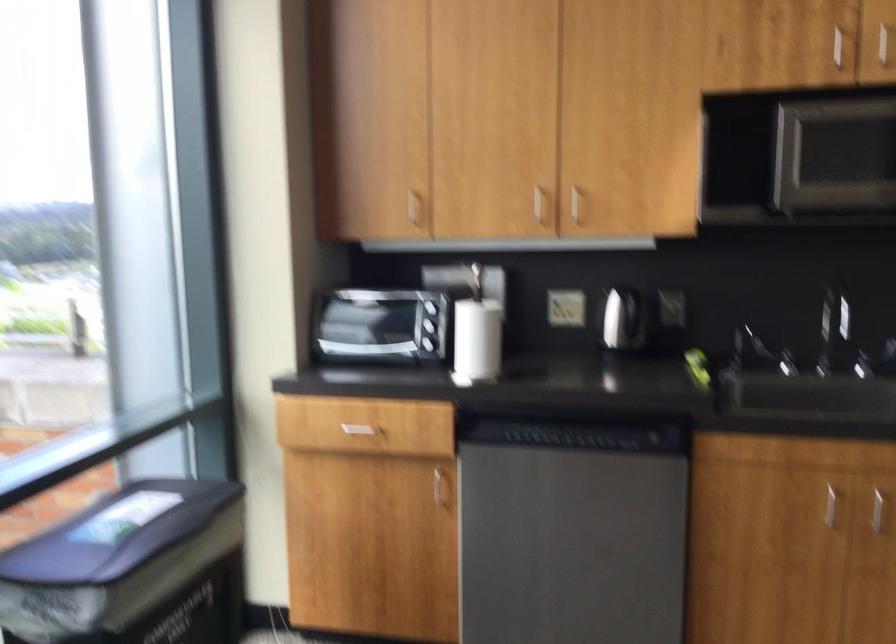
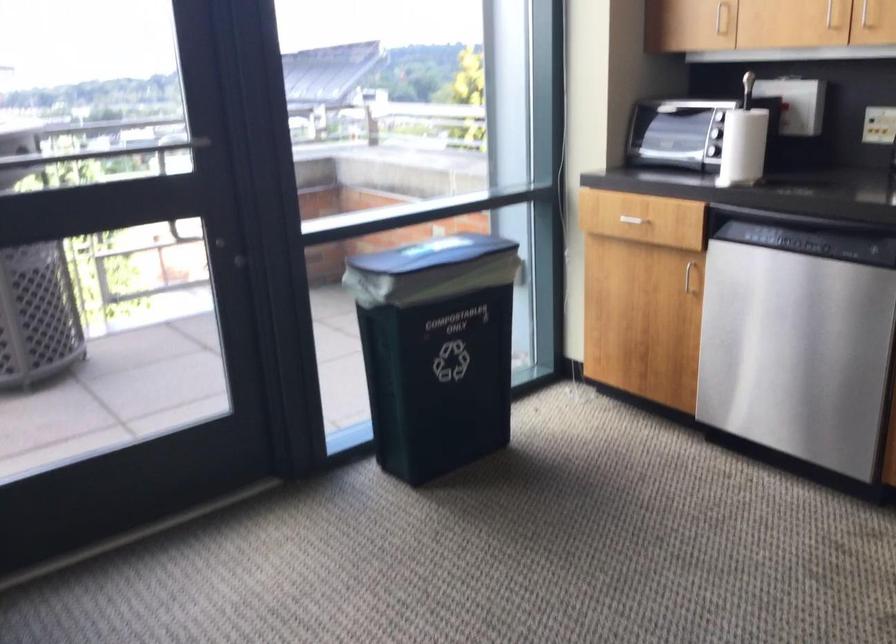
Locate, in the second image, the point that corresponds to the point at 441,489 in the first image.

(690, 276)